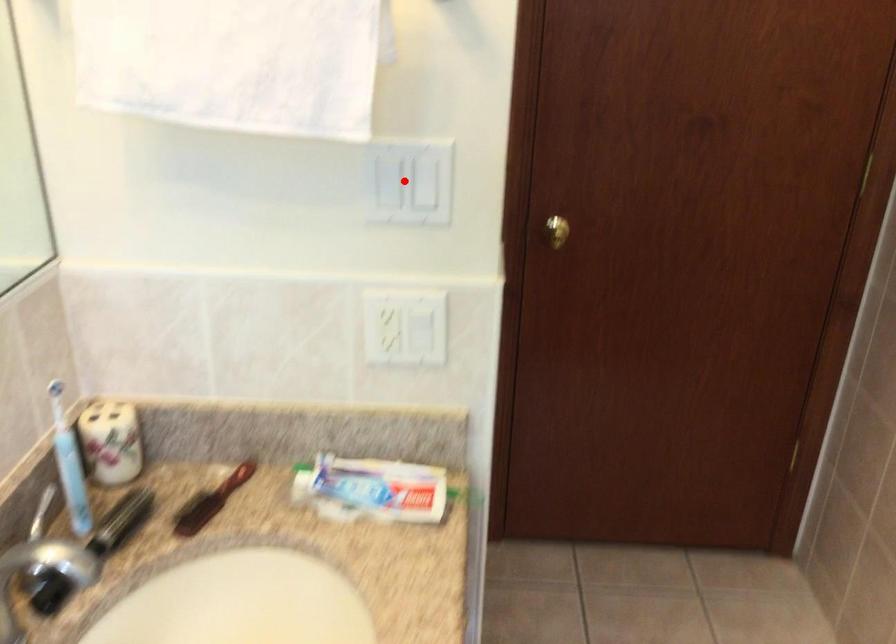
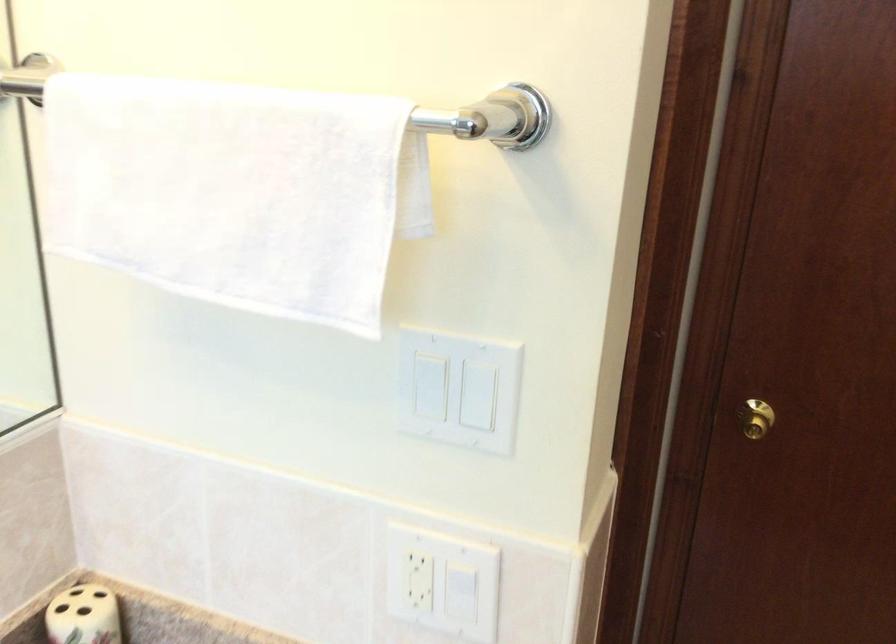
Question: I am providing you with two images of the same scene from different viewpoints. A red point is marked on the first image. At the location where the point appears in image 1, is it still visible in image 2?

Choices:
 (A) Yes
 (B) No

Answer: (A)